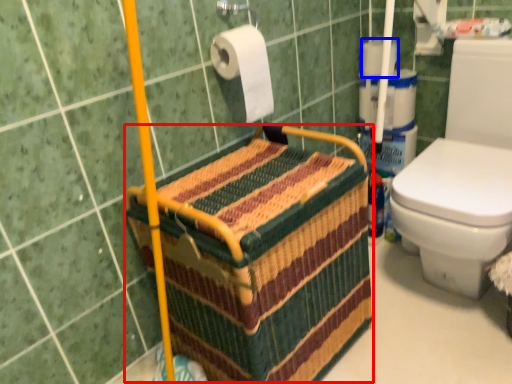
Question: Which point is closer to the camera, basket (highlighted by a red box) or toilet paper (highlighted by a blue box)?

Choices:
 (A) basket
 (B) toilet paper

Answer: (A)